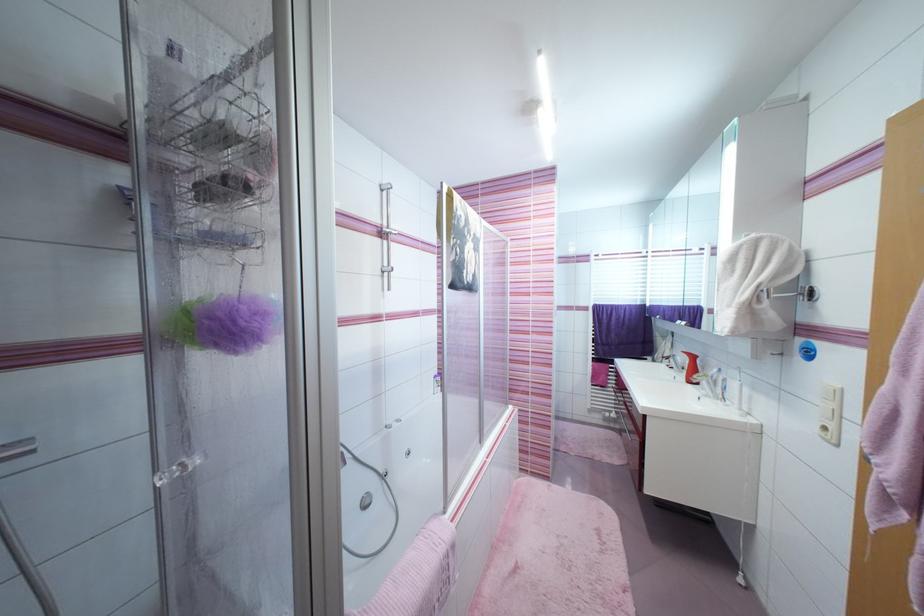
Describe the element at coordinates (386, 233) in the screenshot. This screenshot has width=924, height=616. I see `the shower door handle` at that location.